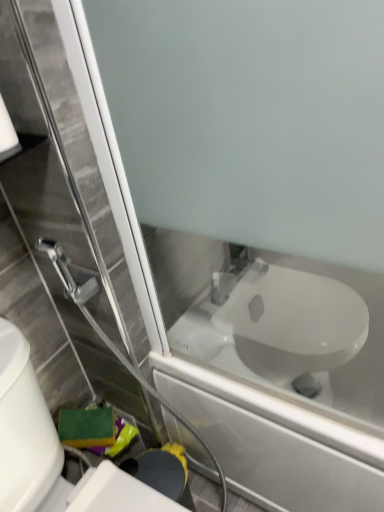
Question: Is white glossy toilet at center smaller than white glossy toilet at lower right?

Choices:
 (A) yes
 (B) no

Answer: (B)

Question: Can you confirm if white glossy toilet at center is thinner than white glossy toilet at lower right?

Choices:
 (A) yes
 (B) no

Answer: (B)

Question: Are white glossy toilet at center and white glossy toilet at lower right making contact?

Choices:
 (A) no
 (B) yes

Answer: (A)

Question: Considering the relative sizes of white glossy toilet at center and white glossy toilet at lower right in the image provided, is white glossy toilet at center bigger than white glossy toilet at lower right?

Choices:
 (A) no
 (B) yes

Answer: (B)

Question: Does white glossy toilet at center appear on the left side of white glossy toilet at lower right?

Choices:
 (A) yes
 (B) no

Answer: (B)

Question: Is the position of white glossy toilet at center less distant than that of white glossy toilet at lower right?

Choices:
 (A) no
 (B) yes

Answer: (A)

Question: Can we say white matte toilet paper at upper left lies outside white glossy toilet at lower right?

Choices:
 (A) no
 (B) yes

Answer: (B)

Question: Can you confirm if white matte toilet paper at upper left is shorter than white glossy toilet at lower right?

Choices:
 (A) yes
 (B) no

Answer: (A)

Question: Can you confirm if white matte toilet paper at upper left is smaller than white glossy toilet at lower right?

Choices:
 (A) yes
 (B) no

Answer: (A)

Question: Is white matte toilet paper at upper left wider than white glossy toilet at lower right?

Choices:
 (A) yes
 (B) no

Answer: (B)

Question: From the image's perspective, is white matte toilet paper at upper left located beneath white glossy toilet at lower right?

Choices:
 (A) yes
 (B) no

Answer: (B)

Question: Considering the relative sizes of white matte toilet paper at upper left and white glossy toilet at lower right in the image provided, is white matte toilet paper at upper left thinner than white glossy toilet at lower right?

Choices:
 (A) no
 (B) yes

Answer: (B)

Question: Is white glossy toilet at lower right oriented towards white matte toilet paper at upper left?

Choices:
 (A) no
 (B) yes

Answer: (A)